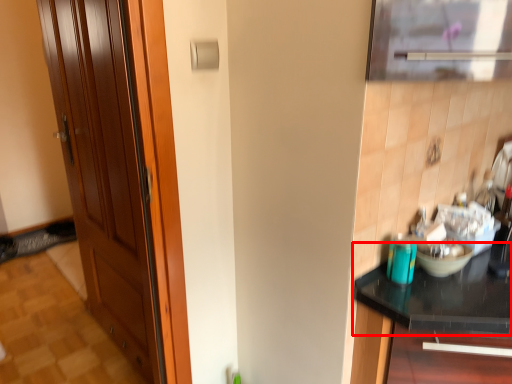
Question: Observing the image, what is the correct spatial positioning of countertop (annotated by the red box) in reference to door?

Choices:
 (A) left
 (B) right

Answer: (B)